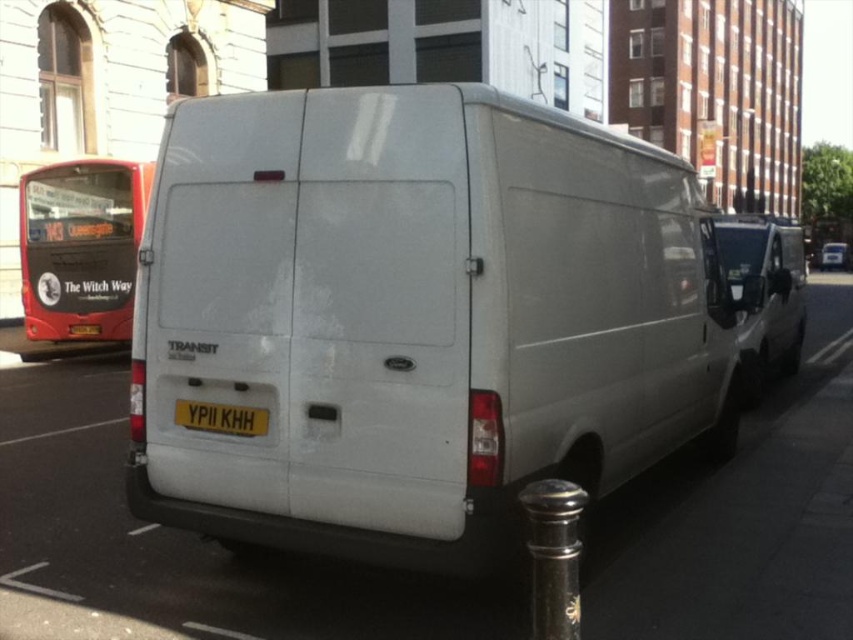
Question: Can you confirm if red painted metal bus at left is positioned above white matte van at right?

Choices:
 (A) yes
 (B) no

Answer: (A)

Question: Can you confirm if white matte van at center is positioned to the left of red painted metal bus at left?

Choices:
 (A) yes
 (B) no

Answer: (B)

Question: Estimate the real-world distances between objects in this image. Which object is farther from the red painted metal bus at left?

Choices:
 (A) yellow metallic license plate at center
 (B) polished metal pole at lower right
 (C) white matte van at center

Answer: (B)

Question: Which object is farther from the camera taking this photo?

Choices:
 (A) yellow metallic license plate at center
 (B) red painted metal bus at left
 (C) white matte van at center

Answer: (B)

Question: Is white matte van at center positioned at the back of polished metal pole at lower right?

Choices:
 (A) no
 (B) yes

Answer: (B)

Question: Which is nearer to the white matte van at right?

Choices:
 (A) yellow metallic license plate at center
 (B) white matte van at center
 (C) polished metal pole at lower right

Answer: (B)